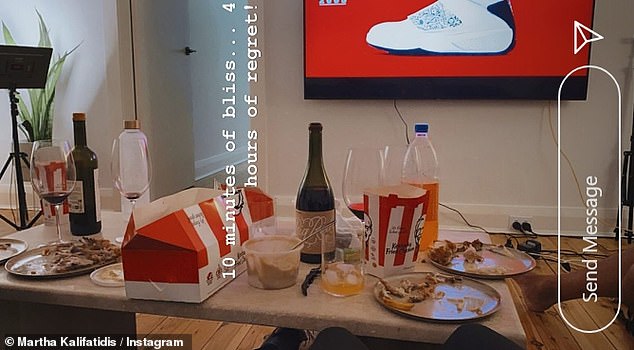
You are a GUI agent. You are given a task and a screenshot of the screen. Output one action in this format:
    pyautogui.click(x=<x>, y=<y>)
    Task: Click on the wine bottle
    This screenshot has height=350, width=634.
    Given the screenshot: What is the action you would take?
    click(321, 204), click(84, 166)